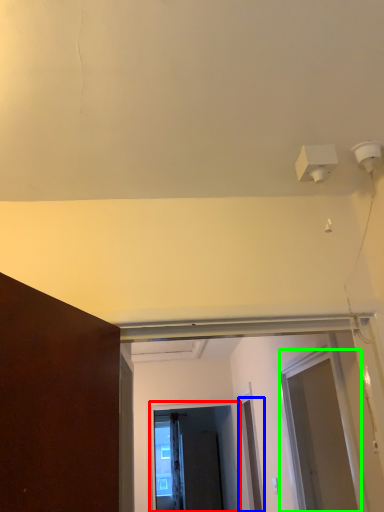
Question: Which object is the farthest from screen door (highlighted by a red box)? Choose among these: door (highlighted by a blue box) or screen door (highlighted by a green box).

Choices:
 (A) door
 (B) screen door

Answer: (B)